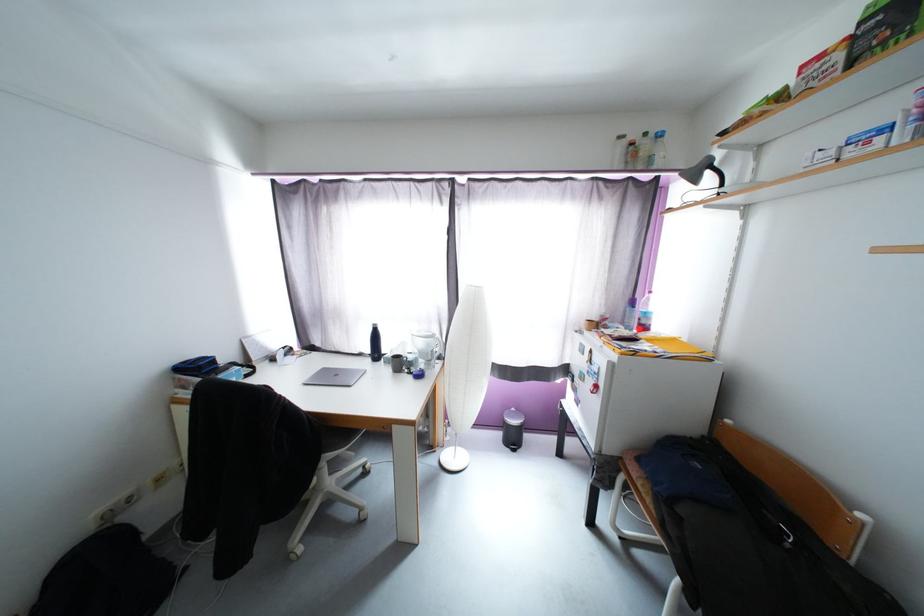
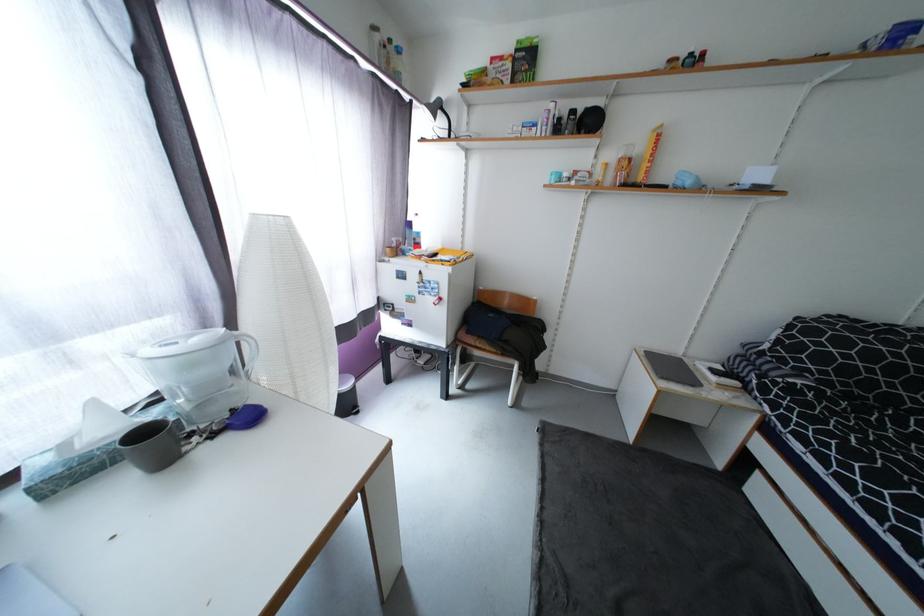
In the second image, find the point that corresponds to (x=640, y=354) in the first image.

(460, 264)